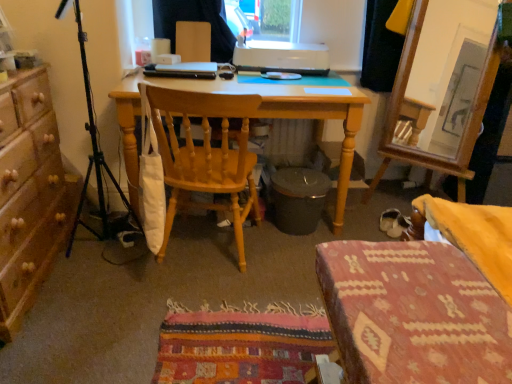
The height and width of the screenshot is (384, 512). In order to click on spots to the right of wooden chair at center in this screenshot , I will do `click(287, 264)`.